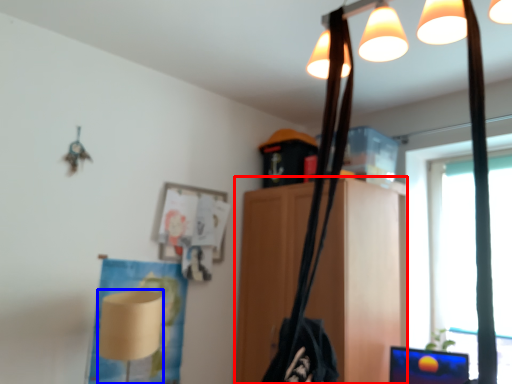
Question: Which object appears farthest to the camera in this image, furniture (highlighted by a red box) or lamp (highlighted by a blue box)?

Choices:
 (A) furniture
 (B) lamp

Answer: (A)